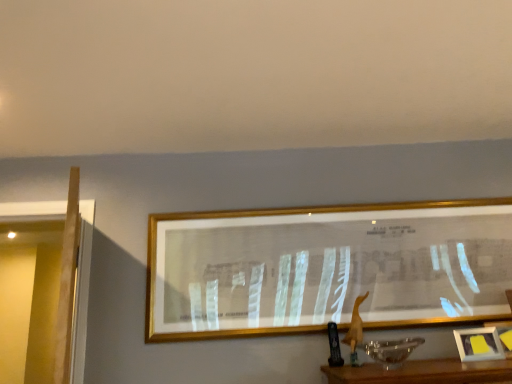
Question: Does yellow paper at lower right, the first picture frame positioned from the front, appear on the left side of gold-framed picture at center, which is counted as the 1th picture frame, starting from the left?

Choices:
 (A) yes
 (B) no

Answer: (B)

Question: Considering the relative sizes of yellow paper at lower right, the 2th picture frame in the left-to-right sequence, and gold-framed picture at center, which is counted as the first picture frame, starting from the back, in the image provided, is yellow paper at lower right, the 2th picture frame in the left-to-right sequence, bigger than gold-framed picture at center, which is counted as the first picture frame, starting from the back,?

Choices:
 (A) no
 (B) yes

Answer: (A)

Question: Is yellow paper at lower right, the 2th picture frame in the left-to-right sequence, outside of gold-framed picture at center, acting as the 2th picture frame starting from the right?

Choices:
 (A) no
 (B) yes

Answer: (B)

Question: Could gold-framed picture at center, acting as the 2th picture frame starting from the right, be considered to be inside yellow paper at lower right, the 2th picture frame in the left-to-right sequence?

Choices:
 (A) yes
 (B) no

Answer: (B)

Question: Does yellow paper at lower right, which ranks as the second picture frame in back-to-front order, come in front of gold-framed picture at center, which is counted as the 1th picture frame, starting from the left?

Choices:
 (A) no
 (B) yes

Answer: (B)

Question: Does yellow paper at lower right, which ranks as the second picture frame in back-to-front order, have a greater height compared to gold-framed picture at center, acting as the 2th picture frame starting from the right?

Choices:
 (A) no
 (B) yes

Answer: (A)

Question: Is there a large distance between gold-framed picture at center, which is counted as the first picture frame, starting from the back, and yellow paper at lower right, which ranks as the second picture frame in back-to-front order?

Choices:
 (A) yes
 (B) no

Answer: (B)

Question: From the image's perspective, would you say gold-framed picture at center, which ranks as the 2th picture frame in front-to-back order, is positioned over yellow paper at lower right, which ranks as the second picture frame in back-to-front order?

Choices:
 (A) yes
 (B) no

Answer: (A)

Question: Does gold-framed picture at center, which is counted as the 1th picture frame, starting from the left, appear on the right side of yellow paper at lower right, the 1th picture frame from the right?

Choices:
 (A) no
 (B) yes

Answer: (A)

Question: Can you confirm if gold-framed picture at center, which ranks as the 2th picture frame in front-to-back order, is shorter than yellow paper at lower right, the 1th picture frame from the right?

Choices:
 (A) yes
 (B) no

Answer: (B)

Question: Does gold-framed picture at center, which is counted as the first picture frame, starting from the back, have a larger size compared to yellow paper at lower right, the 1th picture frame from the right?

Choices:
 (A) yes
 (B) no

Answer: (A)

Question: Is gold-framed picture at center, which is counted as the 1th picture frame, starting from the left, oriented towards yellow paper at lower right, the 2th picture frame in the left-to-right sequence?

Choices:
 (A) yes
 (B) no

Answer: (B)

Question: From a real-world perspective, is yellow paper at lower right, the first picture frame positioned from the front, positioned above or below gold-framed picture at center, which ranks as the 2th picture frame in front-to-back order?

Choices:
 (A) above
 (B) below

Answer: (B)